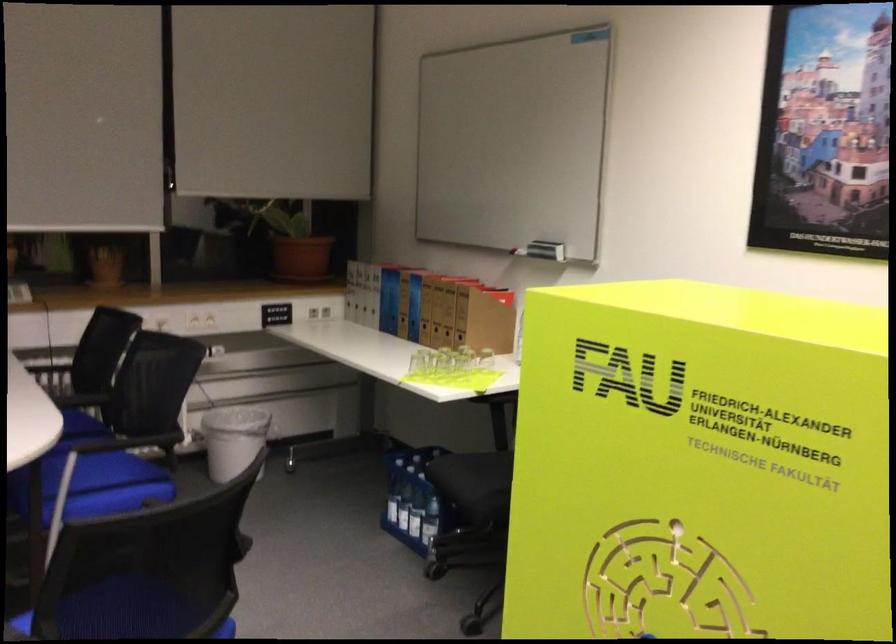
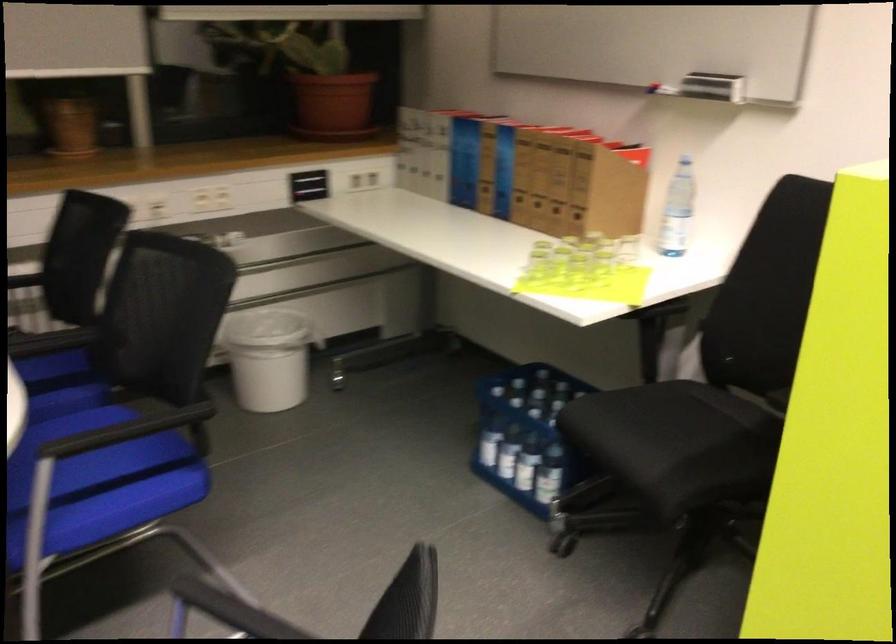
In a continuous first-person perspective shot, in which direction is the camera moving?

The cameraman moved toward left, forward.